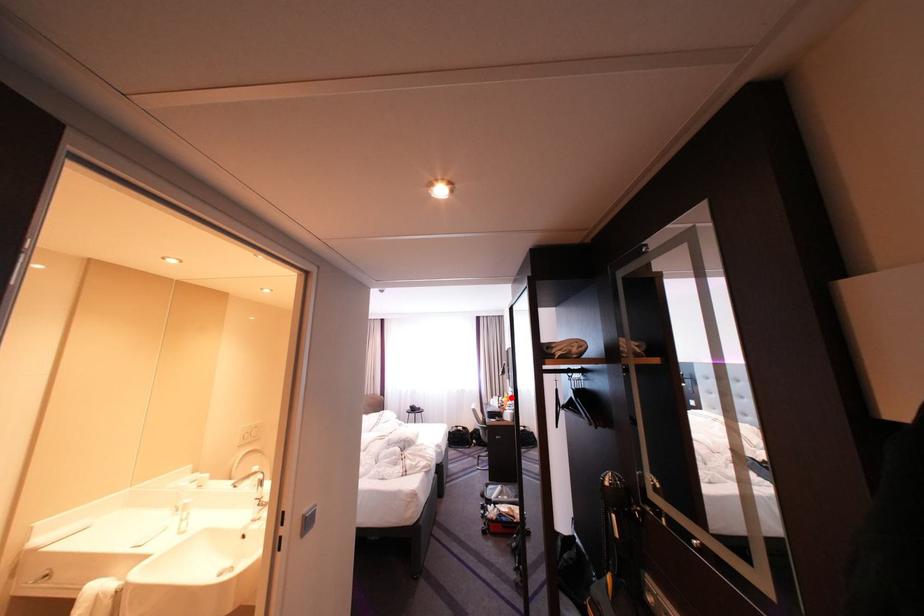
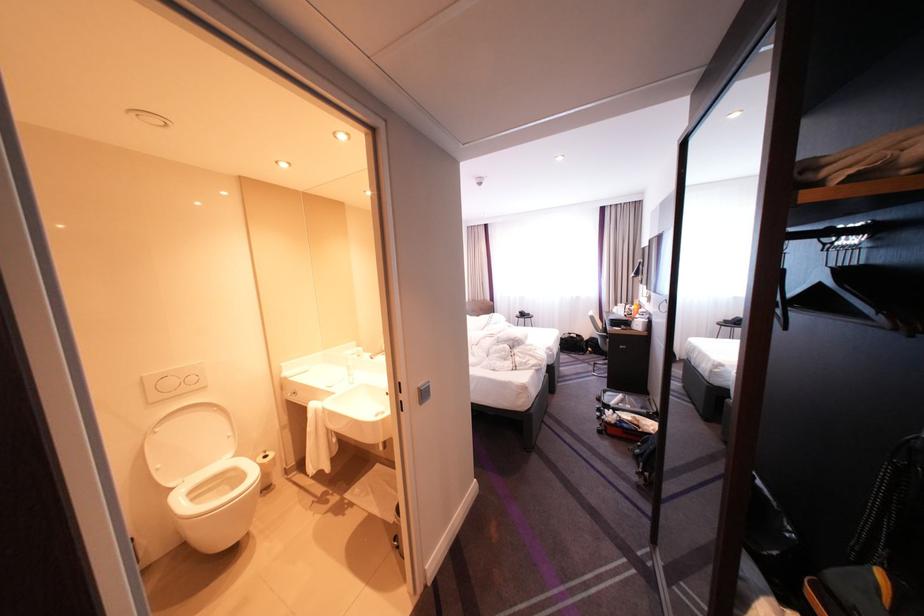
Question: A red point is marked in image1. In image2, is the corresponding 3D point closer to the camera or farther? Reply with the corresponding letter.

Choices:
 (A) The corresponding 3D point is closer.
 (B) The corresponding 3D point is farther.

Answer: (A)